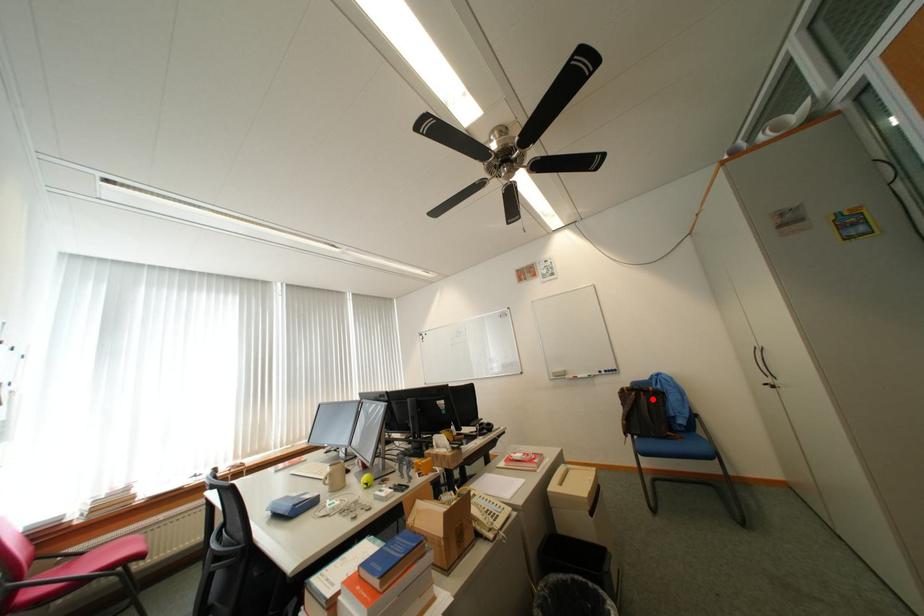
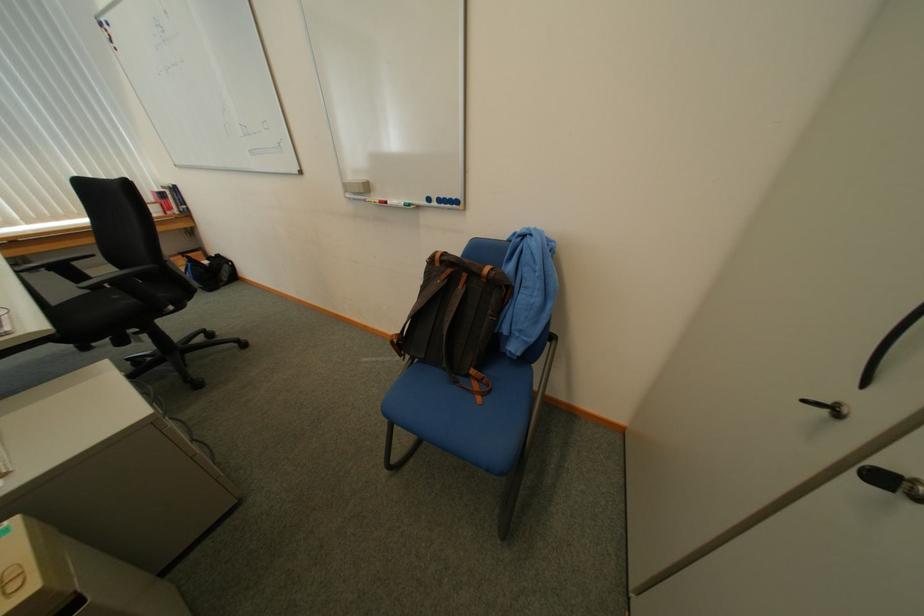
Question: A red point is marked in image1. In image2, is the corresponding 3D point closer to the camera or farther? Reply with the corresponding letter.

Choices:
 (A) The corresponding 3D point is closer.
 (B) The corresponding 3D point is farther.

Answer: (A)